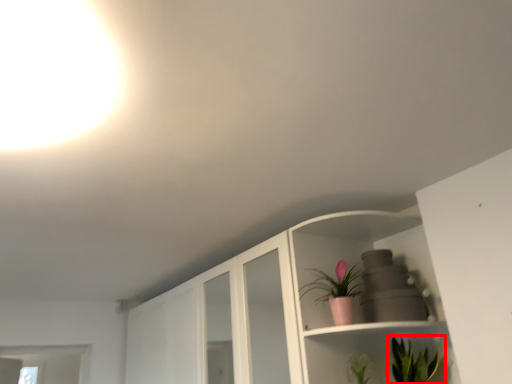
Question: In this image, where is houseplant (annotated by the red box) located relative to houseplant?

Choices:
 (A) left
 (B) right

Answer: (B)